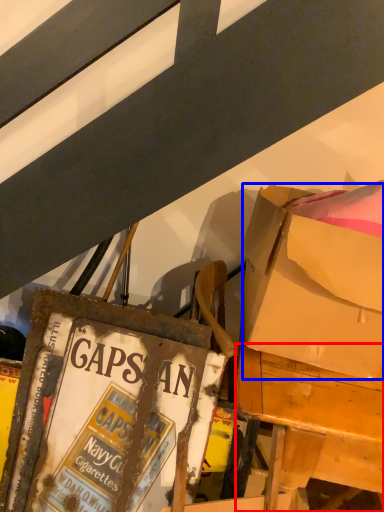
Question: Among these objects, which one is farthest to the camera, desk (highlighted by a red box) or box (highlighted by a blue box)?

Choices:
 (A) desk
 (B) box

Answer: (A)